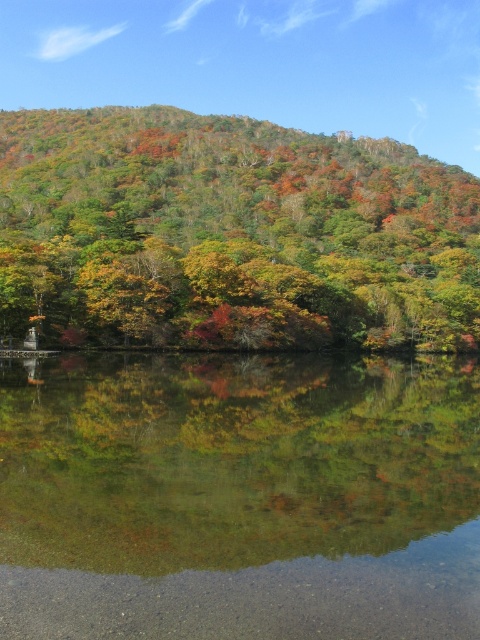
What is the 2D coordinate of the clear glass water at center in the image?

The 2D coordinate of the clear glass water at center is at point [240,497].

You are an artist planning to paint this autumn scene. You want to ensure the clear glass water at center and multicolored foliage at center are proportionally accurate. Which object should you paint first if you want to start with the larger area?

The multicolored foliage at center should be painted first because it occupies more space than the clear glass water at center according to the description.

You are an artist planning to paint the scene. You want to ensure the clear glass water at center and the multicolored foliage at center are proportionally accurate. Which object should you make wider in your painting?

The multicolored foliage at center should be made wider in the painting since it has a greater width than the clear glass water at center according to the description.